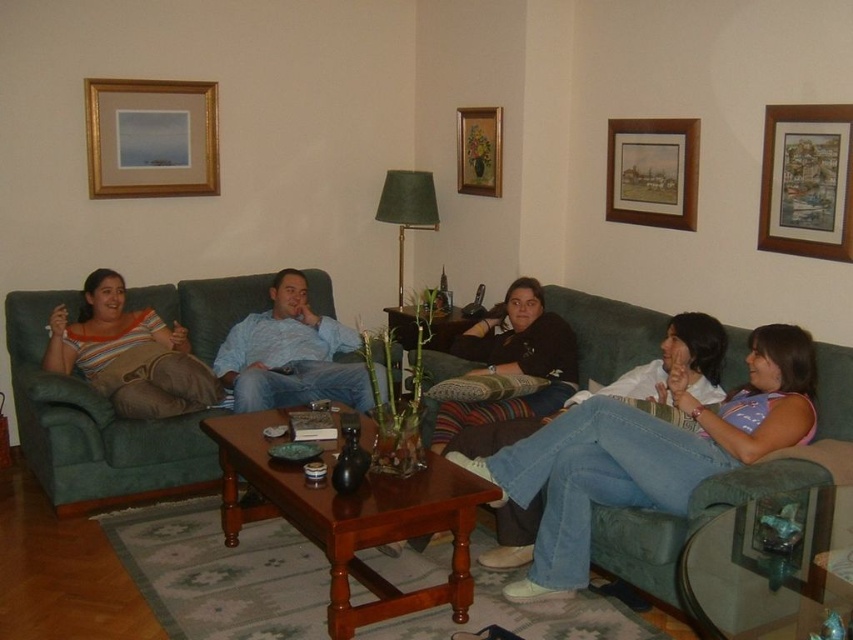
Question: Is green fabric couch at left thinner than wooden picture frame at upper center?

Choices:
 (A) yes
 (B) no

Answer: (B)

Question: Is green fabric couch at left positioned before wooden framed picture at upper right?

Choices:
 (A) no
 (B) yes

Answer: (B)

Question: Which of the following is the closest to the observer?

Choices:
 (A) (608, 308)
 (B) (650, 182)
 (C) (154, 145)
 (D) (190, 442)

Answer: (D)

Question: Among these objects, which one is farthest from the camera?

Choices:
 (A) green fabric couch at center
 (B) green fabric couch at left

Answer: (B)

Question: Does striped cotton shirt at center come behind matte blue shirt at center?

Choices:
 (A) yes
 (B) no

Answer: (B)

Question: Which point is closer to the camera?

Choices:
 (A) gold wooden picture frame at upper center
 (B) wooden framed picture at upper right
 (C) striped cotton shirt at center
 (D) matte blue shirt at center

Answer: (C)